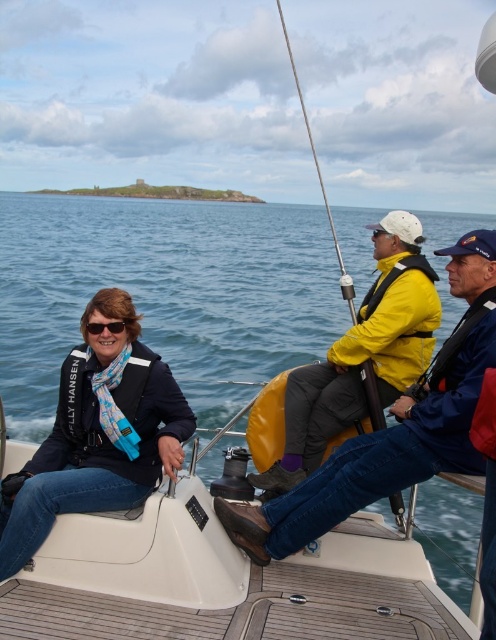
Question: Which object is positioned closest to the black plastic goggles at center?

Choices:
 (A) metallic fishing pole at upper center
 (B) yellow matte jacket at center
 (C) white plastic boat at center
 (D) blue fabric jacket at lower left

Answer: (D)

Question: Is blue fabric jacket at lower left below metallic fishing pole at upper center?

Choices:
 (A) yes
 (B) no

Answer: (A)

Question: Is white plastic boat at center to the right of blue fabric jacket at lower left from the viewer's perspective?

Choices:
 (A) no
 (B) yes

Answer: (A)

Question: Which point is farther to the camera?

Choices:
 (A) blue fabric jacket at lower left
 (B) black plastic goggles at center

Answer: (B)

Question: Which point appears closest to the camera in this image?

Choices:
 (A) (114, 324)
 (B) (395, 216)
 (C) (224, 298)

Answer: (A)

Question: In this image, where is yellow matte jacket at center located relative to black plastic goggles at center?

Choices:
 (A) right
 (B) left

Answer: (A)